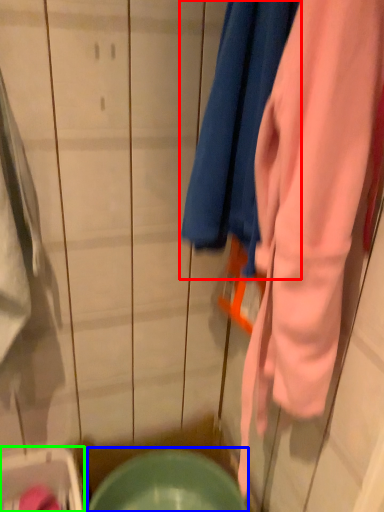
Question: Which is nearer to the towel (highlighted by a red box)? mixing bowl (highlighted by a blue box) or washer (highlighted by a green box).

Choices:
 (A) mixing bowl
 (B) washer

Answer: (A)